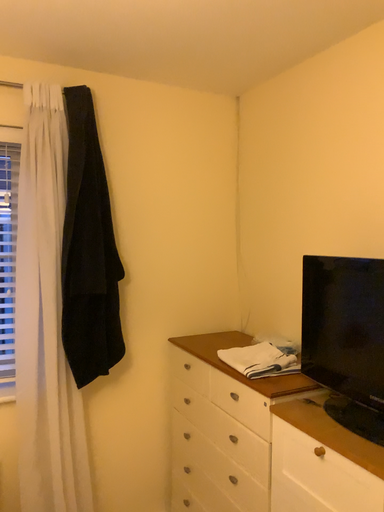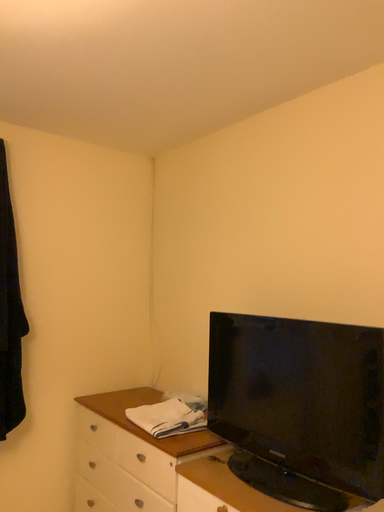
Question: How did the camera likely rotate when shooting the video?

Choices:
 (A) rotated upward
 (B) rotated downward

Answer: (A)